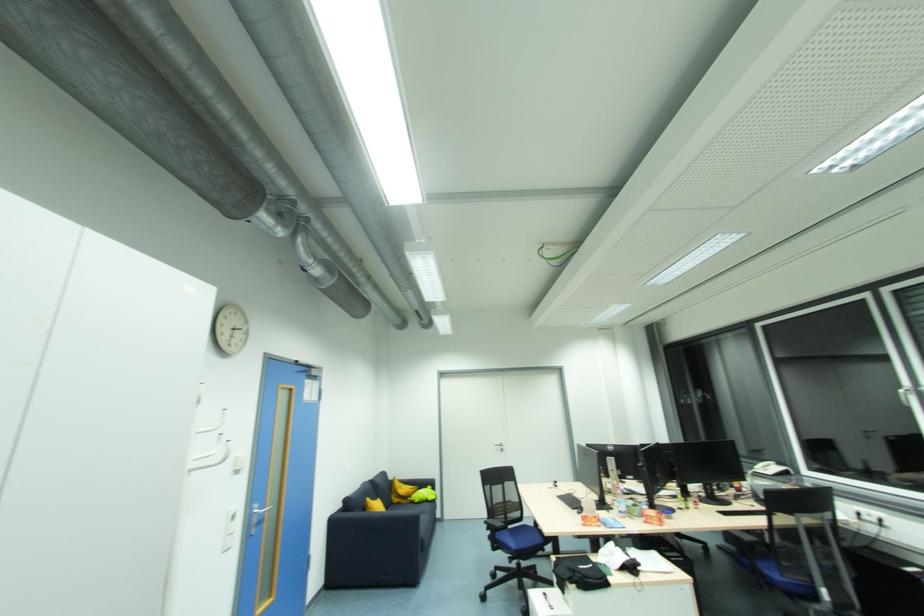
Where is `silver door handle`? This screenshot has width=924, height=616. silver door handle is located at coordinates (256, 523).